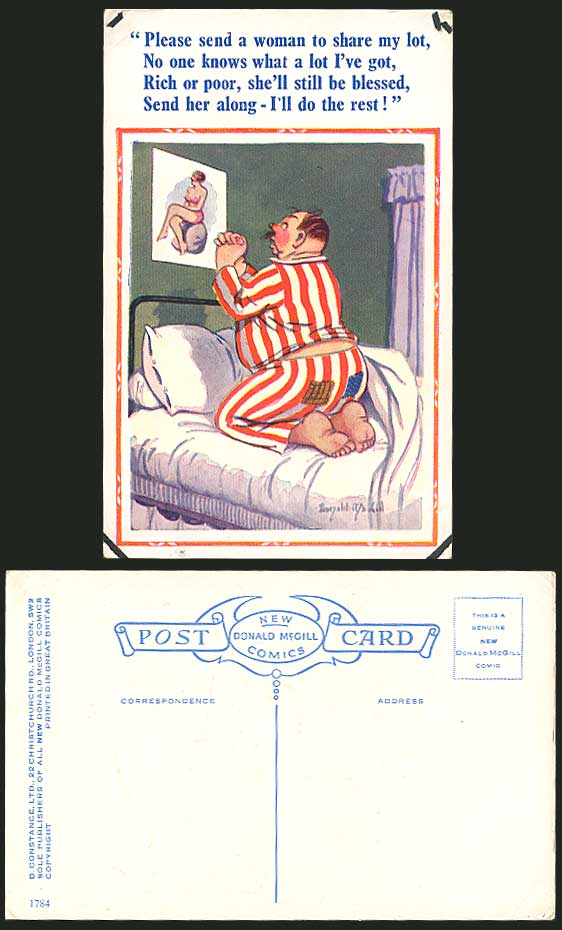
This screenshot has height=930, width=562. I want to click on bed, so click(x=203, y=443).